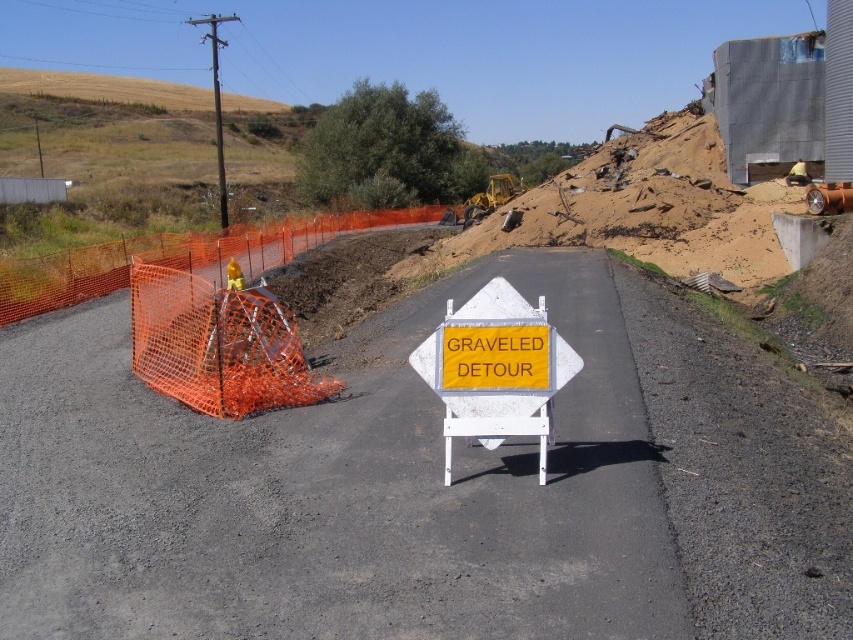
In the scene shown: You are a delivery driver approaching the construction site and need to follow the detour. You see the orange mesh barricade at left and the yellow reflective plastic sign at center. Which object should you look at first to determine your path?

The yellow reflective plastic sign at center is located to the right of the orange mesh barricade at left, so you should look at the yellow reflective plastic sign at center first as it is positioned closer to your current path.

Consider the image. You are a delivery driver approaching the construction site and need to follow the detour. The detour sign is the yellow reflective plastic sign at center. However, you notice an orange mesh fence at left blocking your path. Which object should you prioritize following for safe navigation?

The yellow reflective plastic sign at center is to the right of the orange mesh fence at left, so you should follow the yellow reflective plastic sign at center as it indicates the correct detour path and is positioned away from the blocked area.